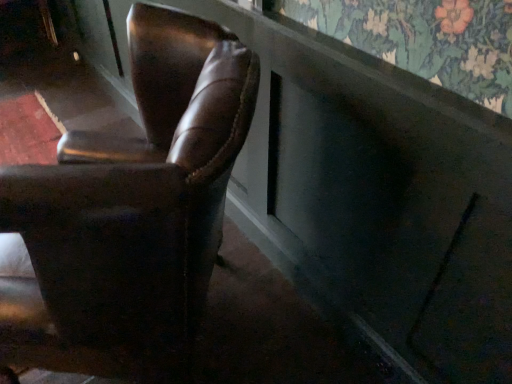
Question: Should I look upward or downward to see brown leather chair at left?

Choices:
 (A) down
 (B) up

Answer: (A)